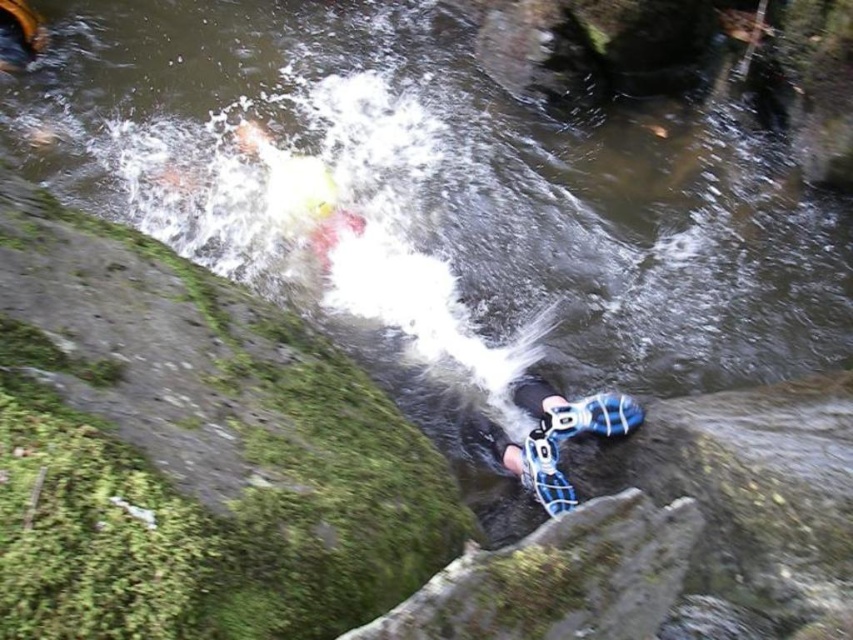
From the picture: You are a hiker who just arrived at the riverbank. You see your blue mesh shoes at lower center and blue mesh shoe at lower center. Which one is bigger?

The blue mesh shoes at lower center is larger than the blue mesh shoe at lower center.

From the picture: You are a photographer trying to capture the best angle of the blue mesh shoes at lower center and the blue mesh shoe at lower center. Since one is higher than the other, which one should you focus on to ensure it doesn

The blue mesh shoes at lower center is taller than the blue mesh shoe at lower center, so focusing on the blue mesh shoes at lower center will ensure you capture the higher one.

You are a photographer trying to capture the best angle of the blue mesh shoes at lower center and the blue mesh shoe at lower center. Which one should you focus on to get a clearer image?

The blue mesh shoes at lower center is closer to the viewer than the blue mesh shoe at lower center, so focusing on it will result in a clearer image.